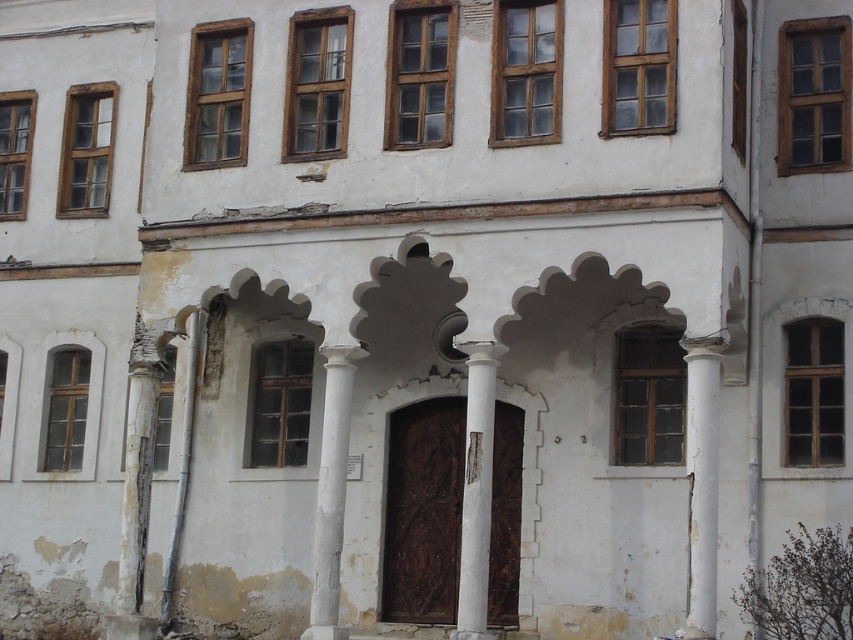
Can you confirm if white smooth column at center is thinner than white stone column at center?

Indeed, white smooth column at center has a lesser width compared to white stone column at center.

Between point (457, 596) and point (310, 634), which one is positioned in front?

Point (310, 634) is more forward.

Who is more distant from viewer, (x=469, y=342) or (x=320, y=548)?

Positioned behind is point (x=320, y=548).

The height and width of the screenshot is (640, 853). What are the coordinates of `white smooth column at center` in the screenshot? It's located at (476, 490).

Is white stone column at right in front of white smooth column at center?

Yes.

Where is `white stone column at right`? The image size is (853, 640). white stone column at right is located at coordinates (701, 481).

Who is more forward, (711, 568) or (489, 452)?

Point (711, 568) is more forward.

Find the location of a particular element. white stone column at right is located at coordinates (701, 481).

Is white stone column at center positioned before white concrete pillar at left?

Yes, white stone column at center is closer to the viewer.

Locate an element on the screen. white stone column at center is located at coordinates (331, 492).